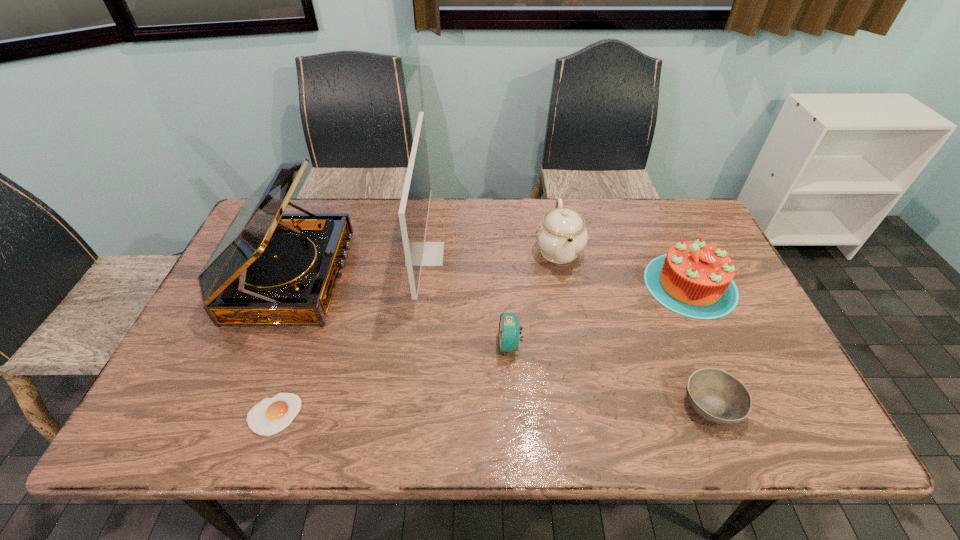
The image size is (960, 540). Find the location of `blank area at the near right corner`. blank area at the near right corner is located at coordinates coord(740,425).

This screenshot has width=960, height=540. Identify the location of free point between the fifth tallest object and the monitor. point(468,299).

This screenshot has width=960, height=540. In order to click on empty location between the bowl and the third object from right to left in this screenshot , I will do `click(635, 327)`.

You are a GUI agent. You are given a task and a screenshot of the screen. Output one action in this format:
    pyautogui.click(x=<x>, y=<y>)
    Task: Click on the free space between the monitor and the cake
    Image resolution: width=960 pixels, height=540 pixels.
    Given the screenshot: What is the action you would take?
    pyautogui.click(x=558, y=269)

The height and width of the screenshot is (540, 960). Find the location of `free space between the cake and the fifth object from right to left`. free space between the cake and the fifth object from right to left is located at coordinates (558, 269).

The width and height of the screenshot is (960, 540). In order to click on vacant space that's between the fifth object from right to left and the cake in this screenshot , I will do `click(558, 269)`.

The height and width of the screenshot is (540, 960). In order to click on empty space between the shortest object and the cake in this screenshot , I will do `click(482, 349)`.

At what (x,y) coordinates should I click in order to perform the action: click on free area in between the cake and the fifth object from right to left. Please return your answer as a coordinate pair (x, y). Looking at the image, I should click on (558, 269).

I want to click on vacant point located between the cake and the bowl, so click(701, 345).

Identify the location of the closest object to the cake. Image resolution: width=960 pixels, height=540 pixels. (561, 235).